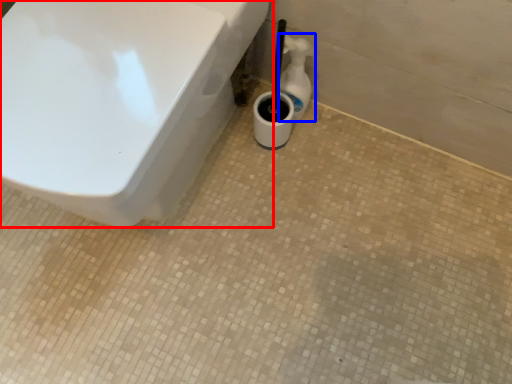
Question: Among these objects, which one is farthest to the camera, toilet (highlighted by a red box) or bottle (highlighted by a blue box)?

Choices:
 (A) toilet
 (B) bottle

Answer: (B)